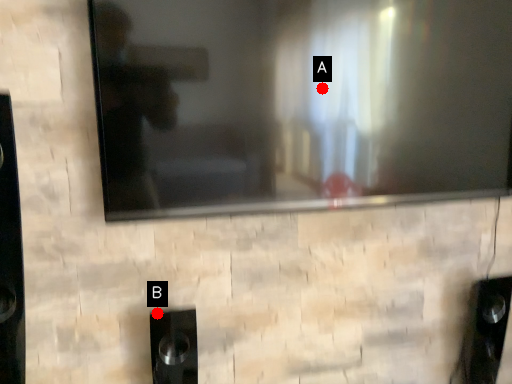
Question: Two points are circled on the image, labeled by A and B beside each circle. Which point appears farthest from the camera in this image?

Choices:
 (A) A is further
 (B) B is further

Answer: (B)